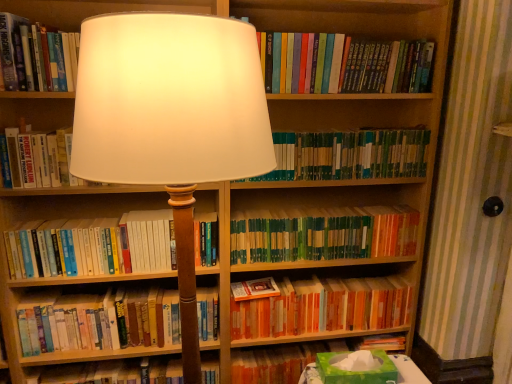
You are a GUI agent. You are given a task and a screenshot of the screen. Output one action in this format:
    pyautogui.click(x=<x>, y=<y>)
    Task: Click on the free point above hardcover book at upper left, which is the 2th book in top-to-bottom order (from a real-world perspective)
    
    Given the screenshot: What is the action you would take?
    pyautogui.click(x=40, y=12)